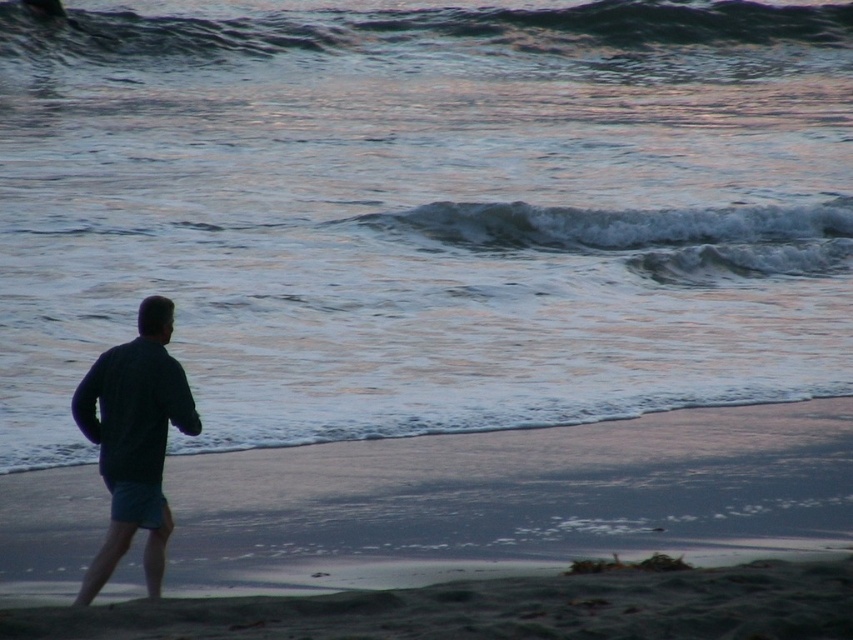
Based on the photo, you are a photographer trying to capture the entire scene of the shiny blue water at center and the white frothy wave at upper center in one shot. Based on their sizes, which object should you focus on to ensure both are visible without cropping?

The shiny blue water at center is wider than the white frothy wave at upper center, so focusing on the wider shiny blue water at center will help capture both objects in the frame.